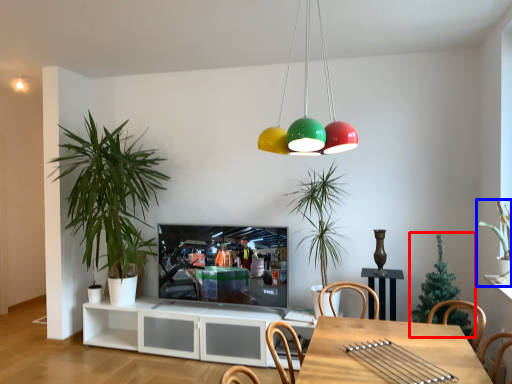
Question: Which of the following is the closest to the observer, houseplant (highlighted by a red box) or houseplant (highlighted by a blue box)?

Choices:
 (A) houseplant
 (B) houseplant

Answer: (B)